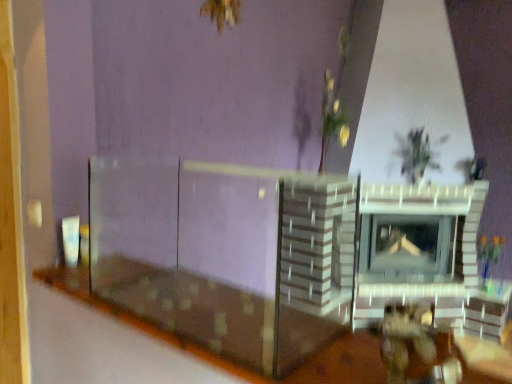
Question: From the image's perspective, is wooden table at lower center above green leafy plant at upper right?

Choices:
 (A) no
 (B) yes

Answer: (A)

Question: Is wooden table at lower center turned away from green leafy plant at upper right?

Choices:
 (A) yes
 (B) no

Answer: (B)

Question: Does wooden table at lower center lie in front of green leafy plant at upper right?

Choices:
 (A) yes
 (B) no

Answer: (A)

Question: Is wooden table at lower center far from green leafy plant at upper right?

Choices:
 (A) yes
 (B) no

Answer: (A)

Question: Can you confirm if wooden table at lower center is taller than green leafy plant at upper right?

Choices:
 (A) no
 (B) yes

Answer: (A)

Question: Considering the relative positions of wooden table at lower center and green leafy plant at upper right in the image provided, is wooden table at lower center to the left of green leafy plant at upper right from the viewer's perspective?

Choices:
 (A) no
 (B) yes

Answer: (B)

Question: From the image's perspective, is green leafy plant at upper right under wooden table at lower center?

Choices:
 (A) no
 (B) yes

Answer: (A)

Question: From a real-world perspective, is green leafy plant at upper right below wooden table at lower center?

Choices:
 (A) no
 (B) yes

Answer: (A)

Question: Could wooden table at lower center be considered to be inside green leafy plant at upper right?

Choices:
 (A) yes
 (B) no

Answer: (B)

Question: Is green leafy plant at upper right shorter than wooden table at lower center?

Choices:
 (A) yes
 (B) no

Answer: (B)

Question: From a real-world perspective, is green leafy plant at upper right over wooden table at lower center?

Choices:
 (A) no
 (B) yes

Answer: (B)

Question: Is green leafy plant at upper right positioned far away from wooden table at lower center?

Choices:
 (A) no
 (B) yes

Answer: (B)

Question: Considering the positions of point [164, 339] and point [460, 165], is point [164, 339] closer or farther from the camera than point [460, 165]?

Choices:
 (A) farther
 (B) closer

Answer: (B)